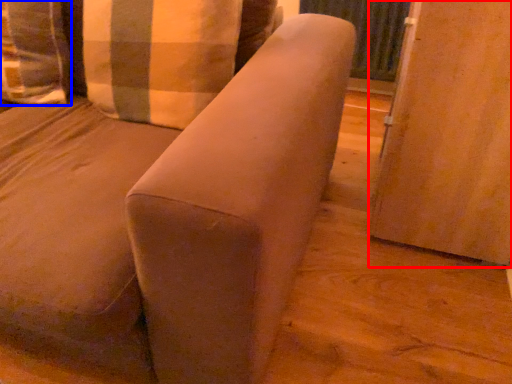
Question: Among these objects, which one is farthest to the camera, screen door (highlighted by a red box) or pillow (highlighted by a blue box)?

Choices:
 (A) screen door
 (B) pillow

Answer: (B)